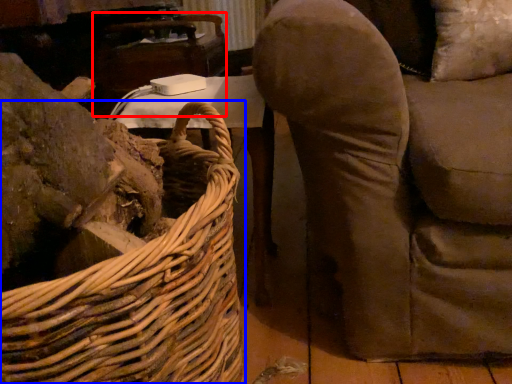
Question: Which object appears farthest to the camera in this image, table (highlighted by a red box) or picnic basket (highlighted by a blue box)?

Choices:
 (A) table
 (B) picnic basket

Answer: (A)